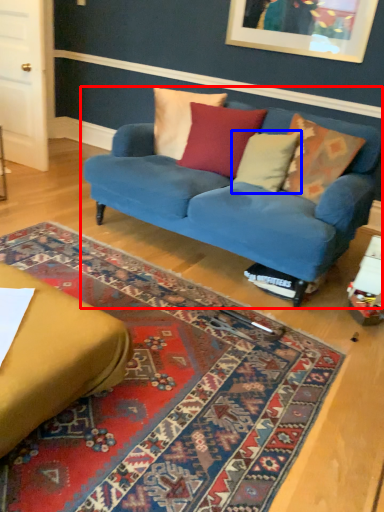
Question: Which object is further to the camera taking this photo, studio couch (highlighted by a red box) or pillow (highlighted by a blue box)?

Choices:
 (A) studio couch
 (B) pillow

Answer: (B)